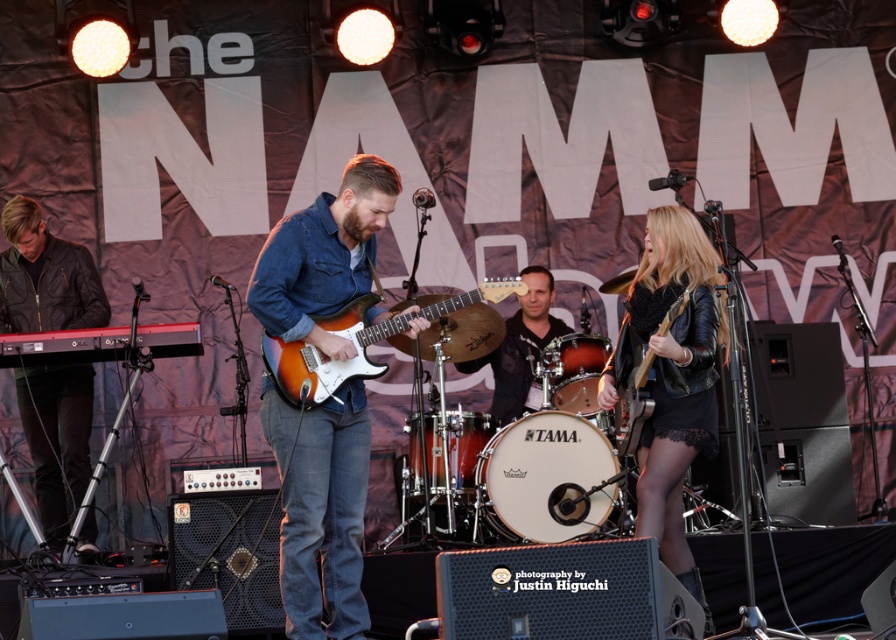
You are a photographer at the NAMM event. You need to capture a photo that includes both the denim jacket at center and the shiny red drum at center. Which object should you zoom in on to ensure both are clearly visible in the frame?

Since the denim jacket at center is bigger than the shiny red drum at center, you should zoom in on the shiny red drum at center to ensure both objects are clearly visible in the frame.

You are a stagehand who needs to adjust the microphone stand between the orange wood electric guitar at center and the matte black guitar at center. Which guitar should you place the microphone closer to based on their positions?

The orange wood electric guitar at center is positioned under the matte black guitar at center. Since the microphone stand should be placed closer to the lower positioned guitar, you should place it closer to the orange wood electric guitar at center.